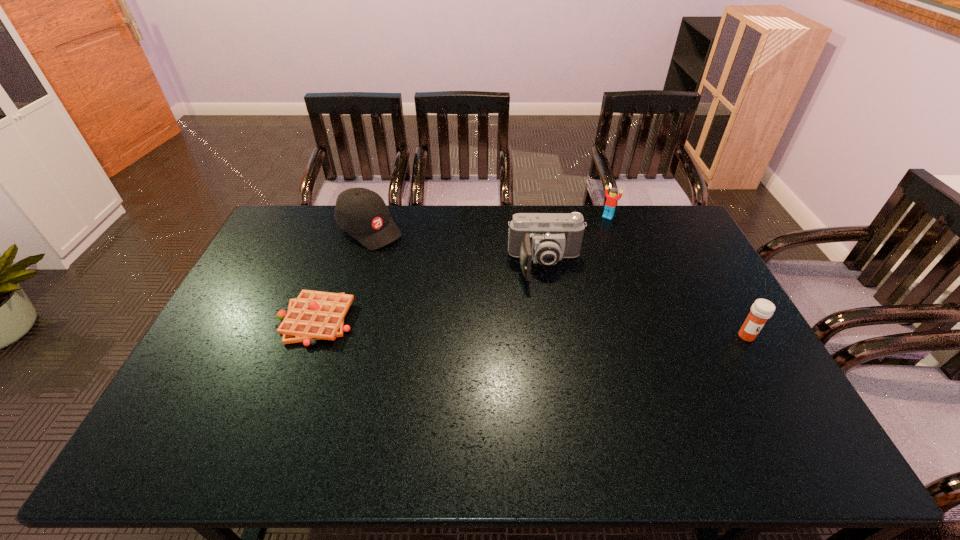
Where is `the shortest object`? The width and height of the screenshot is (960, 540). the shortest object is located at coordinates (313, 315).

Locate an element on the screen. the rightmost object is located at coordinates (761, 310).

Locate an element on the screen. This screenshot has height=540, width=960. Lego is located at coordinates (612, 198).

The height and width of the screenshot is (540, 960). What are the coordinates of `baseball cap` in the screenshot? It's located at (362, 213).

Locate an element on the screen. the third object from right to left is located at coordinates (546, 238).

Locate an element on the screen. The height and width of the screenshot is (540, 960). vacant region located 0.300m on the back of the shortest object is located at coordinates (346, 237).

This screenshot has width=960, height=540. In order to click on free space located 0.220m on the label side of the rightmost object in this screenshot , I will do `click(790, 414)`.

Identify the location of vacant space located 0.380m on the face of the Lego. (567, 279).

You are a GUI agent. You are given a task and a screenshot of the screen. Output one action in this format:
    pyautogui.click(x=<x>, y=<y>)
    Task: Click on the vacant point located on the face of the Lego
    The width and height of the screenshot is (960, 540).
    Given the screenshot: What is the action you would take?
    pyautogui.click(x=584, y=253)

Find the location of a particular element. This screenshot has height=540, width=960. free space located on the face of the Lego is located at coordinates (578, 263).